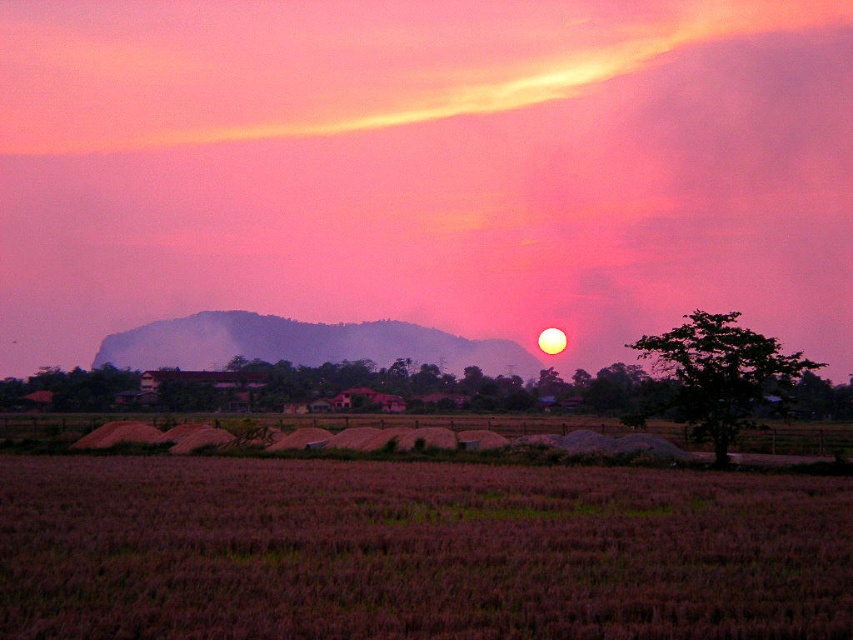
Is point (45, 90) farther from camera compared to point (695, 404)?

That is True.

Is point (773, 136) behind point (722, 412)?

That is True.

Locate an element on the screen. The image size is (853, 640). pink matte cloud at upper center is located at coordinates (425, 164).

Image resolution: width=853 pixels, height=640 pixels. What do you see at coordinates (416, 552) in the screenshot?
I see `purple matte rice field at lower center` at bounding box center [416, 552].

You are a GUI agent. You are given a task and a screenshot of the screen. Output one action in this format:
    pyautogui.click(x=<x>, y=<y>)
    Task: Click on the purple matte rice field at lower center
    
    Given the screenshot: What is the action you would take?
    pyautogui.click(x=416, y=552)

Can you confirm if pink matte cloud at upper center is taller than purple matte rice field at lower center?

Yes.

Does pink matte cloud at upper center come in front of purple matte rice field at lower center?

No.

Find the location of a particular element. Image resolution: width=853 pixels, height=640 pixels. pink matte cloud at upper center is located at coordinates (425, 164).